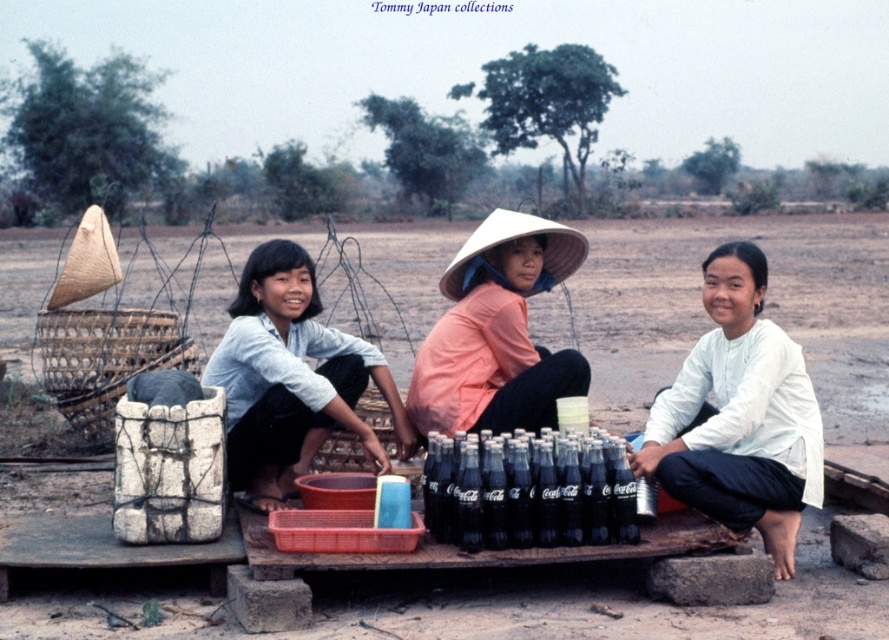
Who is more distant from viewer, (x=717, y=397) or (x=282, y=484)?

The point (x=282, y=484) is behind.

Between white cotton shirt at center and light blue cotton shirt at center, which one has less height?

light blue cotton shirt at center

Where is `white cotton shirt at center`? The height and width of the screenshot is (640, 889). white cotton shirt at center is located at coordinates (739, 416).

Find the location of a particular element. This screenshot has width=889, height=640. white cotton shirt at center is located at coordinates (739, 416).

Can you confirm if white cotton shirt at center is thinner than pink fabric hat at center?

No.

Which of these two, white cotton shirt at center or pink fabric hat at center, stands taller?

white cotton shirt at center is taller.

Is point (773, 440) farther from viewer compared to point (462, 307)?

No.

Find the location of `white cotton shirt at center`. white cotton shirt at center is located at coordinates (739, 416).

You are a GUI agent. You are given a task and a screenshot of the screen. Output one action in this format:
    pyautogui.click(x=<x>, y=<y>)
    Task: Click on the light blue cotton shirt at center
    This screenshot has width=889, height=640.
    Given the screenshot: What is the action you would take?
    pyautogui.click(x=291, y=380)

Can you confirm if light blue cotton shirt at center is positioned to the right of pink fabric hat at center?

In fact, light blue cotton shirt at center is to the left of pink fabric hat at center.

The image size is (889, 640). I want to click on light blue cotton shirt at center, so (291, 380).